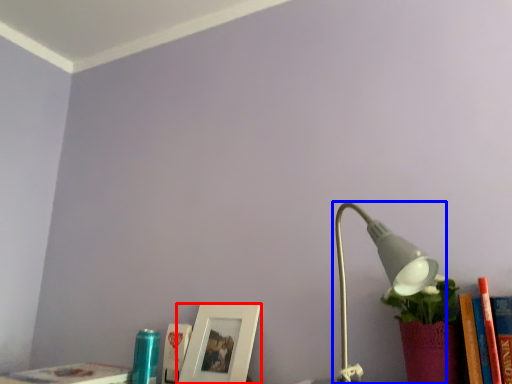
Question: Among these objects, which one is nearest to the camera, picture frame (highlighted by a red box) or lamp (highlighted by a blue box)?

Choices:
 (A) picture frame
 (B) lamp

Answer: (B)